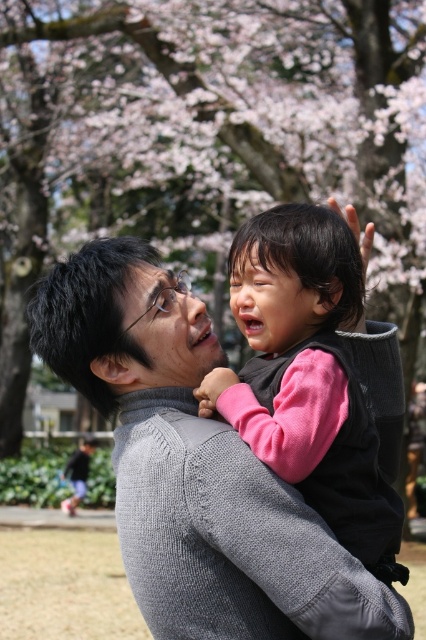
Question: Where is smooth pink blossoms at upper center located in relation to pink fleece vest at center in the image?

Choices:
 (A) below
 (B) above

Answer: (B)

Question: Which object appears closest to the camera in this image?

Choices:
 (A) pink fleece vest at center
 (B) gray knitted sweater at center
 (C) smooth pink blossoms at upper center

Answer: (B)

Question: Is smooth pink blossoms at upper center further to camera compared to gray knitted sweater at center?

Choices:
 (A) no
 (B) yes

Answer: (B)

Question: Estimate the real-world distances between objects in this image. Which object is closer to the pink fleece vest at center?

Choices:
 (A) gray knitted sweater at center
 (B) smooth pink blossoms at upper center

Answer: (A)

Question: Among these objects, which one is farthest from the camera?

Choices:
 (A) smooth pink blossoms at upper center
 (B) pink fleece vest at center

Answer: (A)

Question: Is gray knitted sweater at center positioned behind pink fleece vest at center?

Choices:
 (A) no
 (B) yes

Answer: (A)